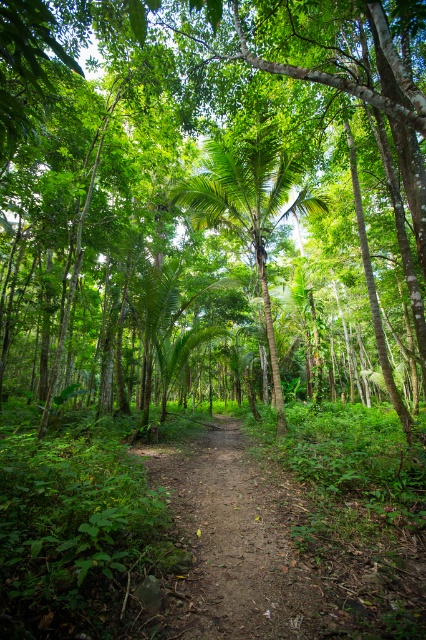
Between point (210, 166) and point (227, 595), which one is positioned behind?

Point (210, 166)

Is green leafy tree at center in front of dirt path at center?

Yes.

Is point (345, 51) closer to viewer compared to point (247, 561)?

No, (345, 51) is behind (247, 561).

At what (x,y) coordinates should I click in order to perform the action: click on green leafy tree at center. Please return your answer as a coordinate pair (x, y). Image resolution: width=426 pixels, height=640 pixels. Looking at the image, I should click on (192, 182).

Which is more to the right, green leafy tree at center or green leafy palm tree at center?

green leafy palm tree at center is more to the right.

Is point (347, 83) behind point (270, 323)?

No, it is in front of (270, 323).

You are a GUI agent. You are given a task and a screenshot of the screen. Output one action in this format:
    pyautogui.click(x=<x>, y=<y>)
    Task: Click on the green leafy tree at center
    The height and width of the screenshot is (640, 426).
    Given the screenshot: What is the action you would take?
    pyautogui.click(x=192, y=182)

Does dirt path at center appear on the left side of green leafy palm tree at center?

Yes, dirt path at center is to the left of green leafy palm tree at center.

Between point (203, 467) and point (267, 232), which one is positioned behind?

The point (267, 232) is more distant.

Identify the location of dirt path at center. (235, 541).